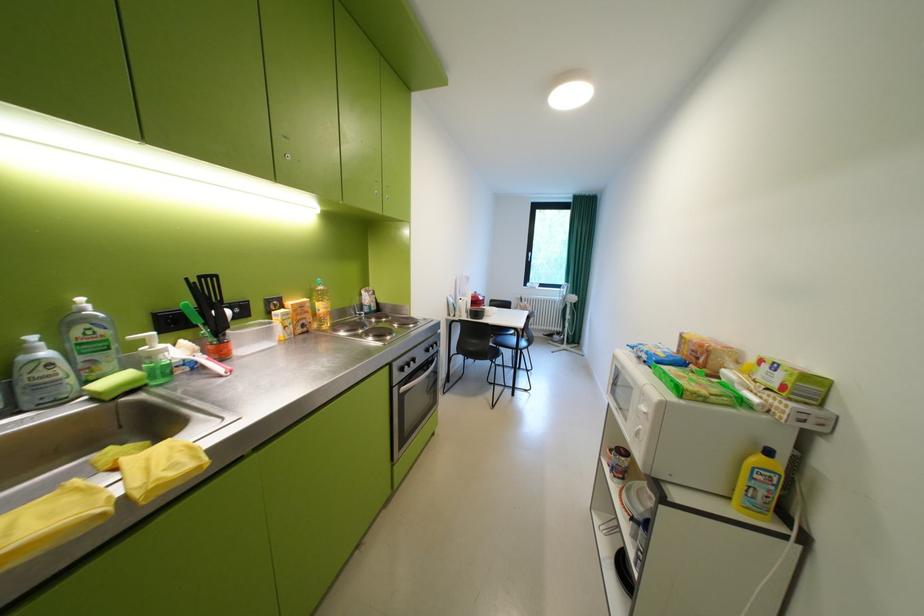
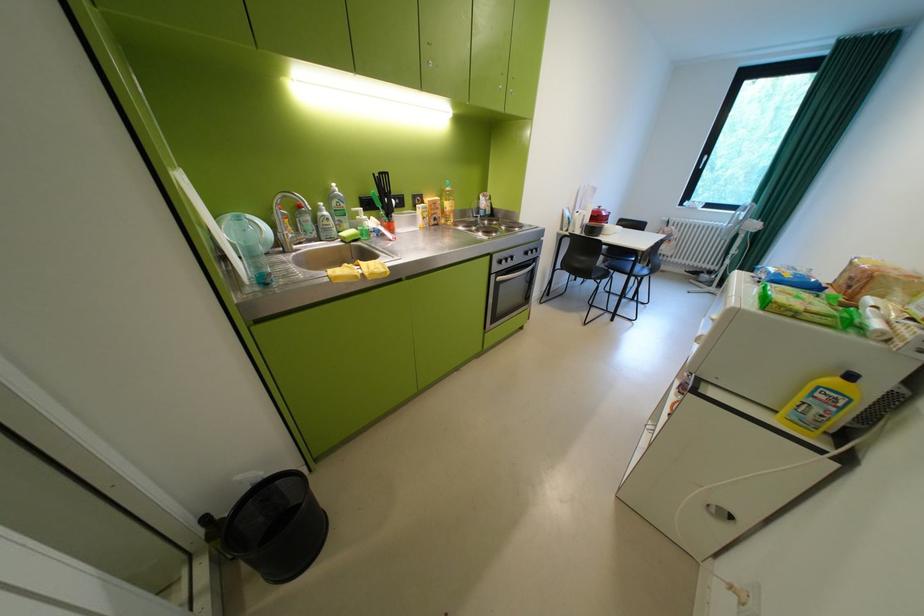
Where in the second image is the point corresponding to (x=459, y=315) from the first image?

(572, 230)